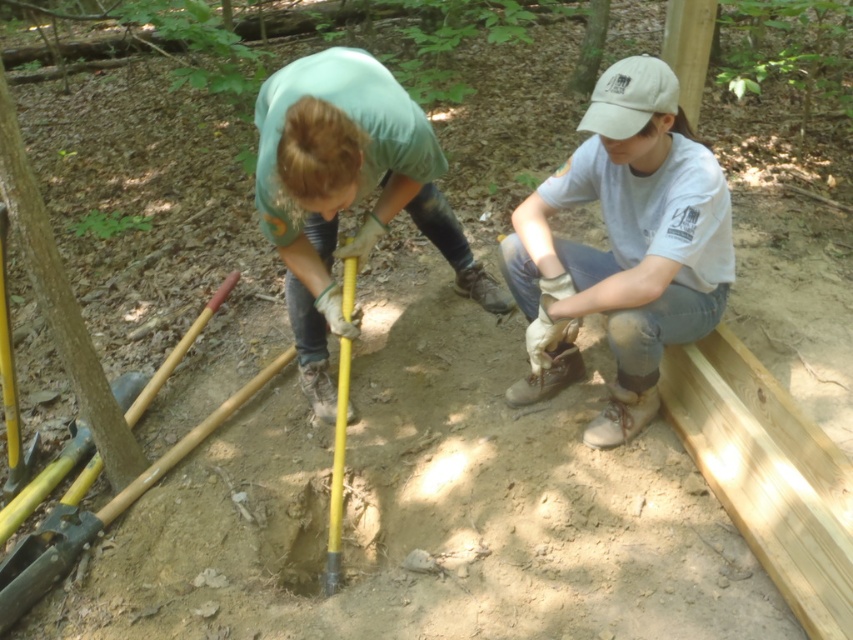
Question: Based on their relative distances, which object is nearer to the yellow plastic shovel at center?

Choices:
 (A) green fabric shirt at center
 (B) white cotton cap at upper center

Answer: (A)

Question: Is white cotton cap at upper center positioned at the back of yellow plastic shovel at center?

Choices:
 (A) no
 (B) yes

Answer: (A)

Question: Estimate the real-world distances between objects in this image. Which object is farther from the yellow plastic shovel at center?

Choices:
 (A) smooth dirt hole at center
 (B) white cotton cap at upper center
 (C) green fabric shirt at center

Answer: (B)

Question: Is green fabric shirt at center thinner than yellow plastic shovel at center?

Choices:
 (A) yes
 (B) no

Answer: (B)

Question: Can you confirm if green fabric shirt at center is positioned above yellow plastic shovel at center?

Choices:
 (A) no
 (B) yes

Answer: (B)

Question: Which point is farther to the camera?

Choices:
 (A) (263, 198)
 (B) (573, 243)
 (C) (300, 561)
 (D) (343, 264)

Answer: (B)